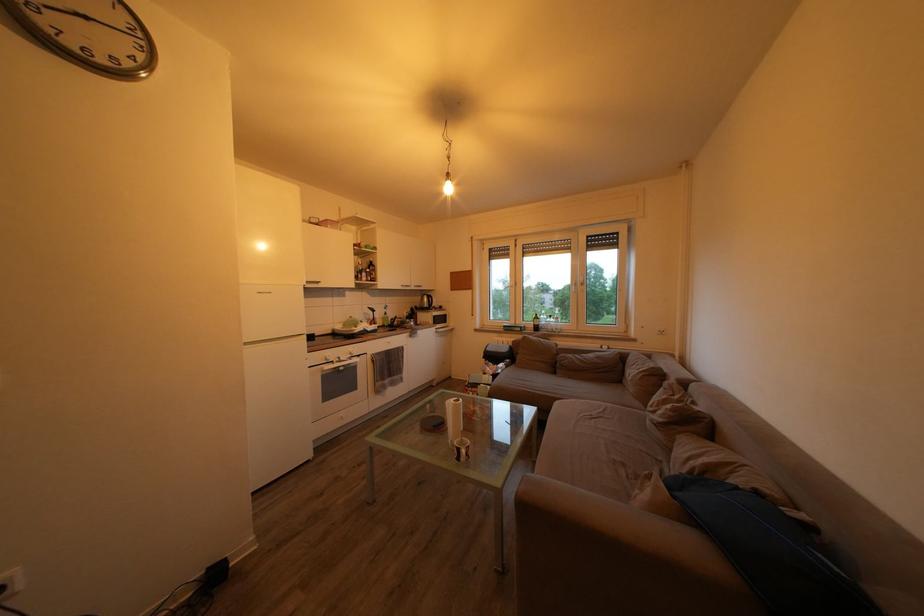
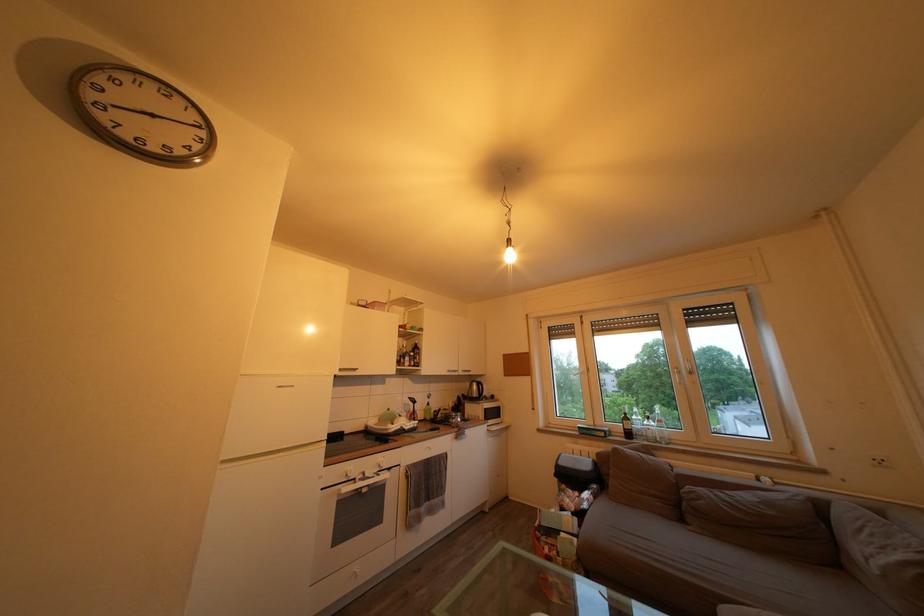
In the second image, find the point that corresponds to [349,363] in the first image.

(375, 480)